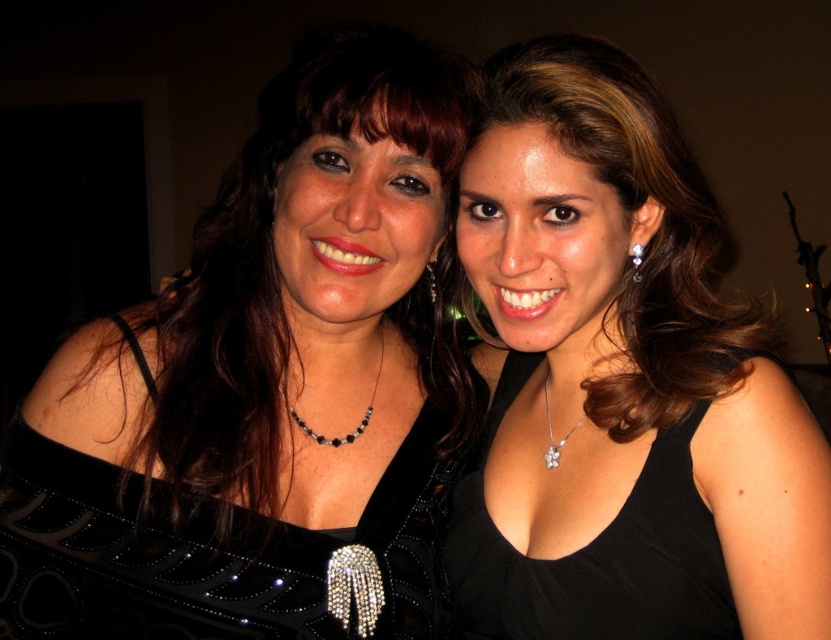
You are a photographer setting up a shoot. You notice there is a black satin dress at center marked by point (622,381). Where should you position your camera to ensure the dress is the main focus of the photo?

Position the camera so that the point (622,381) is centered in the frame to make the black satin dress at center the main focus.

You are a photographer trying to focus on the shiny black dress at center and the black beaded necklace at center. Which one should you adjust your camera focus to capture more clearly if you want to highlight the intricate details of the object with greater height?

The shiny black dress at center has a greater height compared to the black beaded necklace at center, so you should adjust your camera focus on the shiny black dress at center to capture its intricate details more clearly.